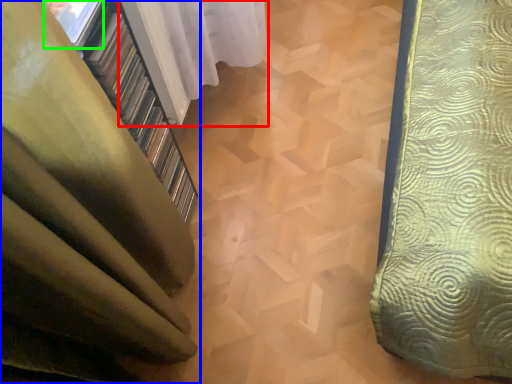
Question: Which object is positioned farthest from curtain (highlighted by a red box)? Select from curtain (highlighted by a blue box) and window (highlighted by a green box).

Choices:
 (A) curtain
 (B) window

Answer: (A)